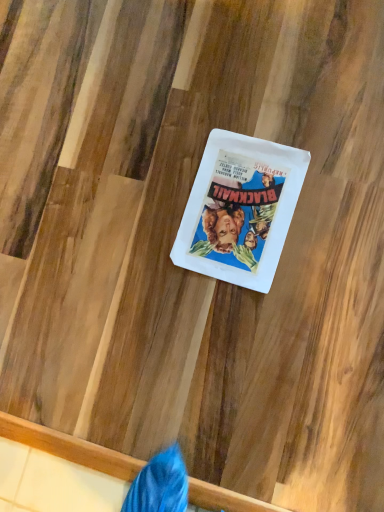
Locate an element on the screen. The height and width of the screenshot is (512, 384). vacant space positioned to the left of white paper at center is located at coordinates (148, 283).